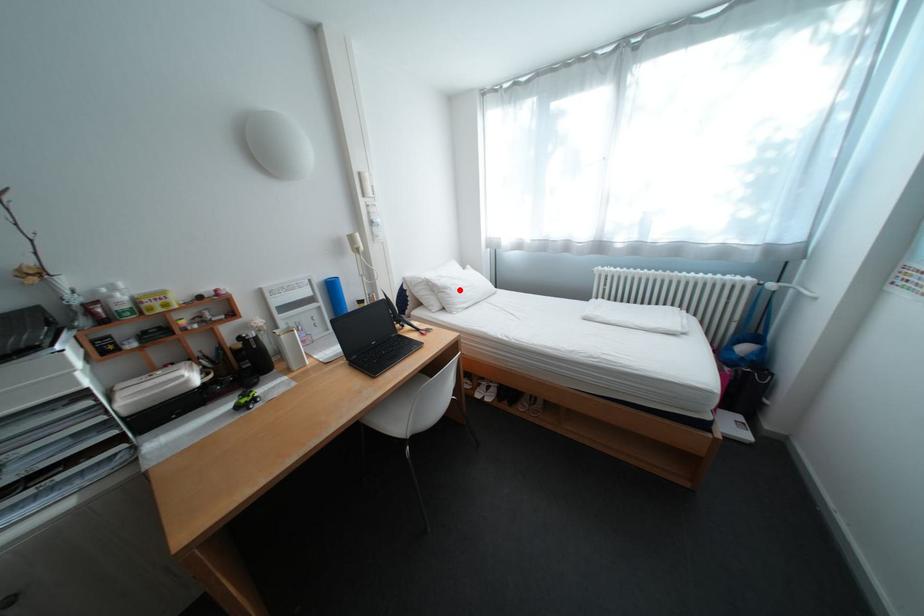
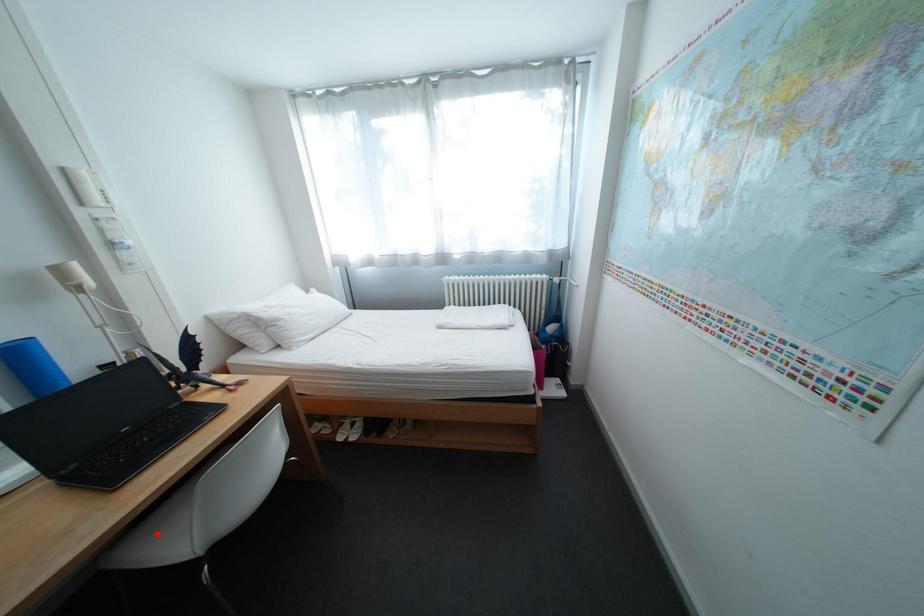
I am providing you with two images of the same scene from different viewpoints. A red point is marked on the first image and another point is marked on the second image. Is the red point in image1 aligned with the point shown in image2?

No